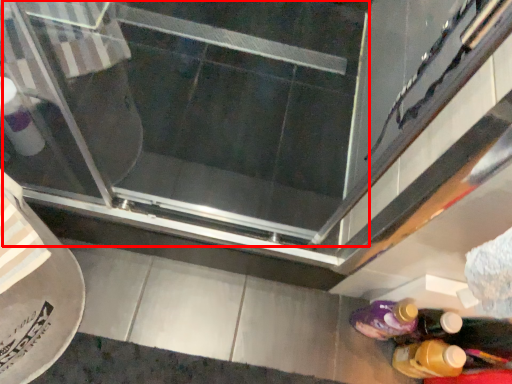
Question: From the image's perspective, where is screen door (annotated by the red box) located relative to bottle?

Choices:
 (A) below
 (B) above

Answer: (B)